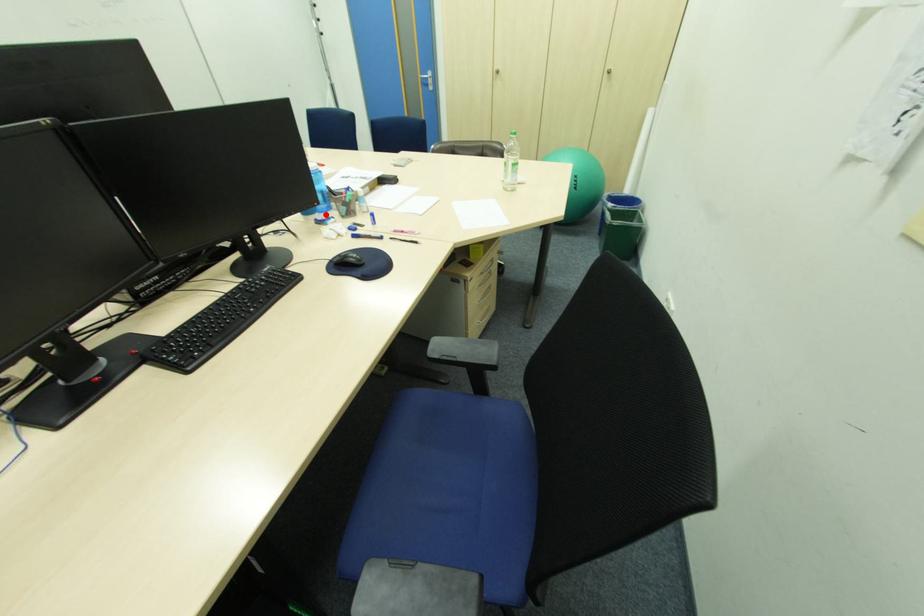
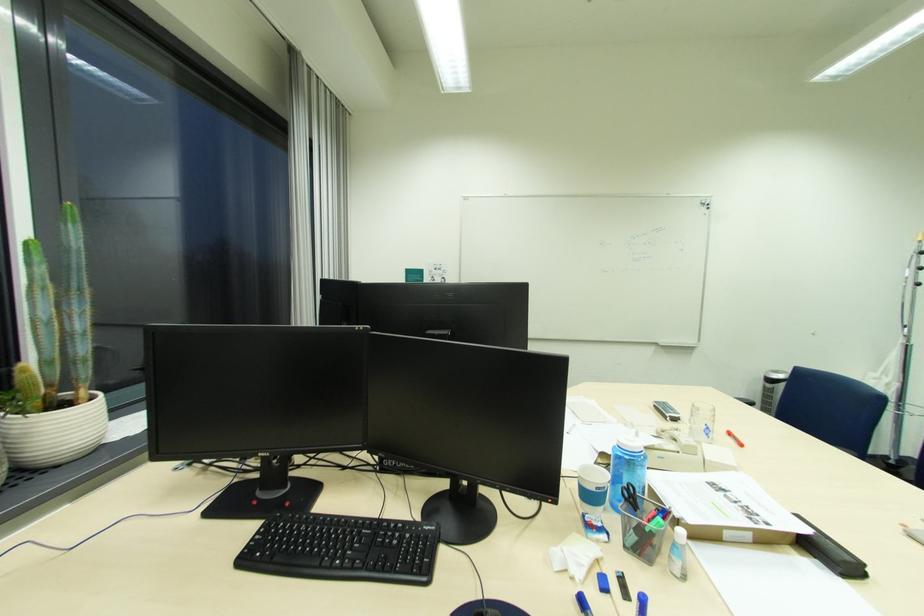
The point at the highlighted location is marked in the first image. Where is the corresponding point in the second image?

(616, 511)